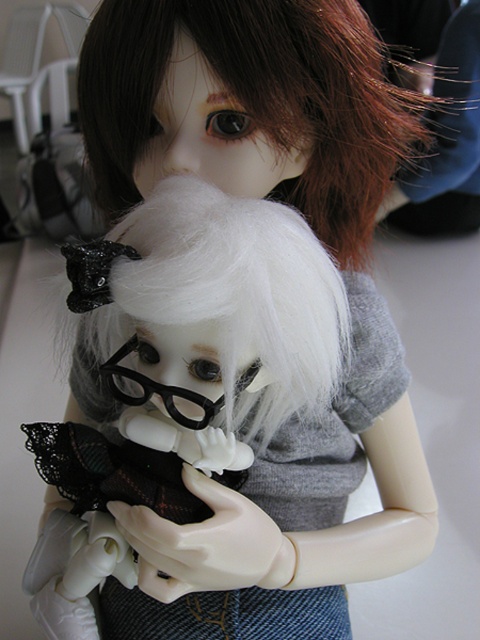
You are a stylist preparing to style the dark brown silky hair at upper center and the matte gray hair at upper center. Which hair has a wider width?

The dark brown silky hair at upper center has a larger width than the matte gray hair at upper center according to the description.

You are a photographer trying to capture the perfect shot of the two dolls. You notice a specific point marked at coordinates point [257,99]. What does this point correspond to on the dolls?

The point [257,99] corresponds to the dark brown silky hair at upper center of the doll in the foreground.